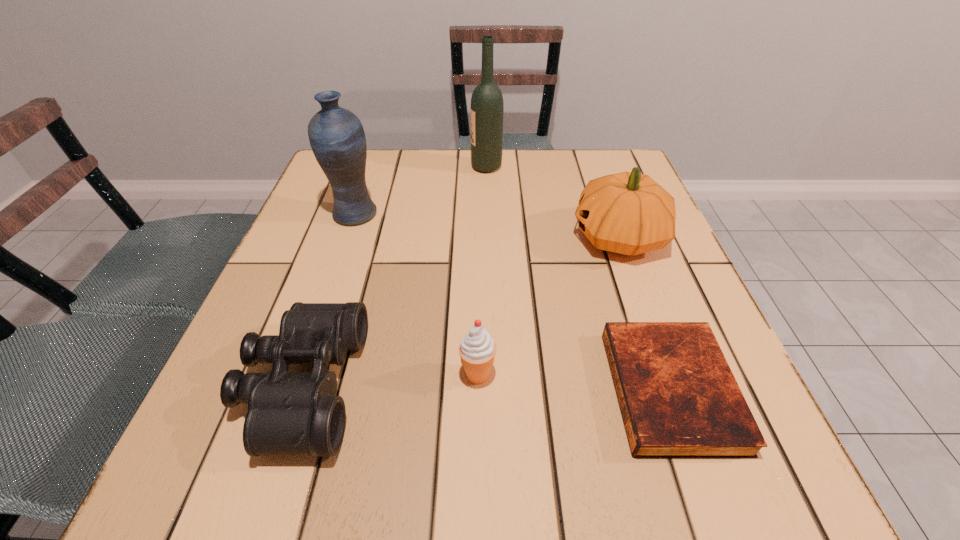
Locate an element on the screen. The width and height of the screenshot is (960, 540). vacant region at the right edge is located at coordinates (628, 283).

You are a GUI agent. You are given a task and a screenshot of the screen. Output one action in this format:
    pyautogui.click(x=<x>, y=<y>)
    Task: Click on the vacant space at the far left corner
    This screenshot has width=960, height=540.
    Given the screenshot: What is the action you would take?
    pyautogui.click(x=317, y=184)

Where is `vacant area that lies between the gourd and the shortest object`? This screenshot has width=960, height=540. vacant area that lies between the gourd and the shortest object is located at coordinates (645, 314).

Image resolution: width=960 pixels, height=540 pixels. What are the coordinates of `free space between the binoculars and the third shortest object` in the screenshot? It's located at (391, 380).

This screenshot has width=960, height=540. Identify the location of free space between the shortest object and the fourth shortest object. tap(645, 314).

Identify the location of free area in between the gourd and the second shortest object. (461, 312).

Locate an element on the screen. This screenshot has width=960, height=540. free space between the vase and the wine bottle is located at coordinates (420, 191).

Find the location of a particular element. This screenshot has height=540, width=960. vacant point located between the gourd and the second shortest object is located at coordinates (461, 312).

In order to click on free space between the shortest object and the icecream in this screenshot , I will do `click(574, 382)`.

Image resolution: width=960 pixels, height=540 pixels. What are the coordinates of `empty space between the vase and the gourd` in the screenshot? It's located at (487, 226).